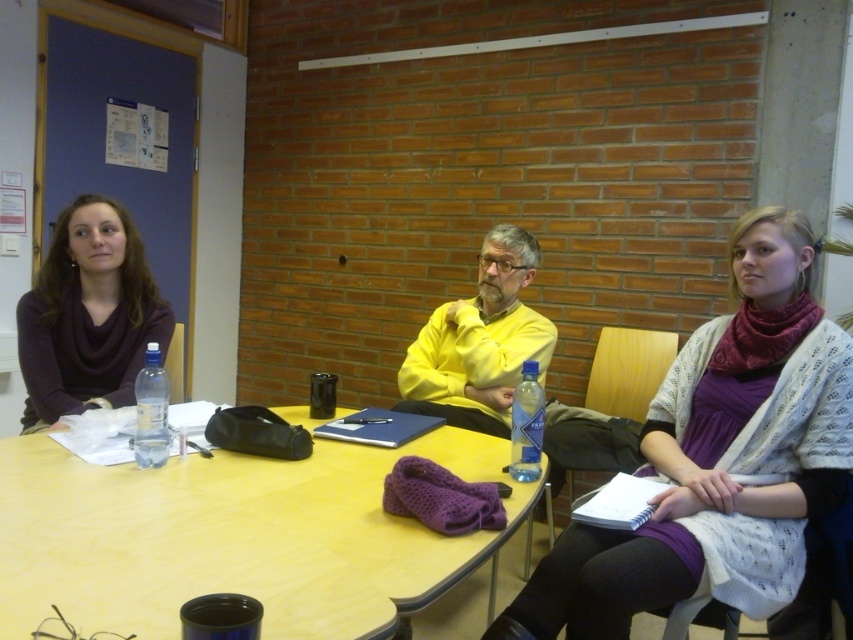
You are standing in the room and want to take a photo of the point at coordinates (770, 508). The camera you are using has a minimum focus distance of 5 feet. Will the camera be able to focus on the point?

The point at coordinates (770, 508) is 4.89 feet from the camera, which is within the camera minimum focus distance of 5 feet. Therefore, the camera can focus on the point.

You are organizing a small event and need to choose between placing a decorative item on the matte black sweater at left or the clear plastic bottle at table center. Based on their sizes, which object can accommodate a larger decorative item?

The matte black sweater at left has a larger size compared to the clear plastic bottle at table center, so it can accommodate a larger decorative item.